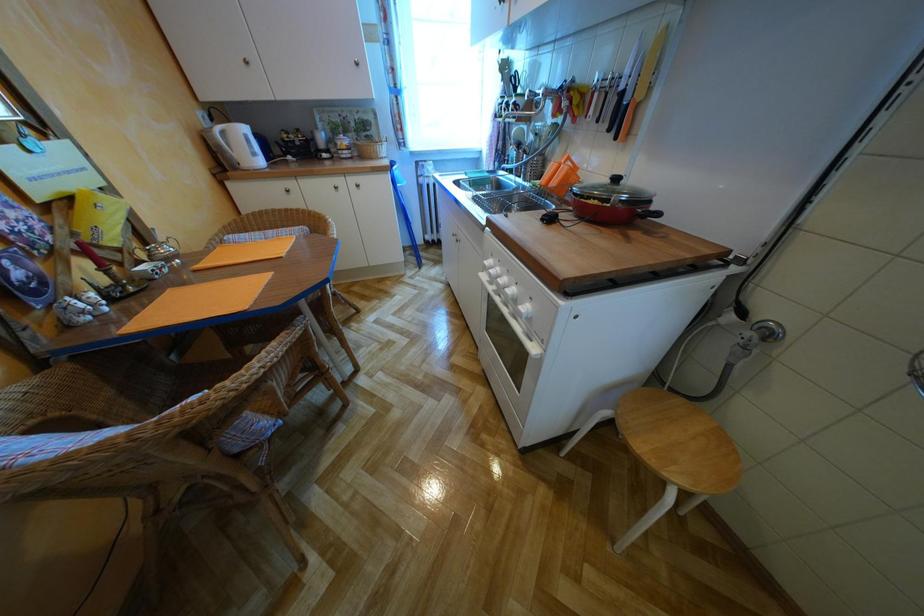
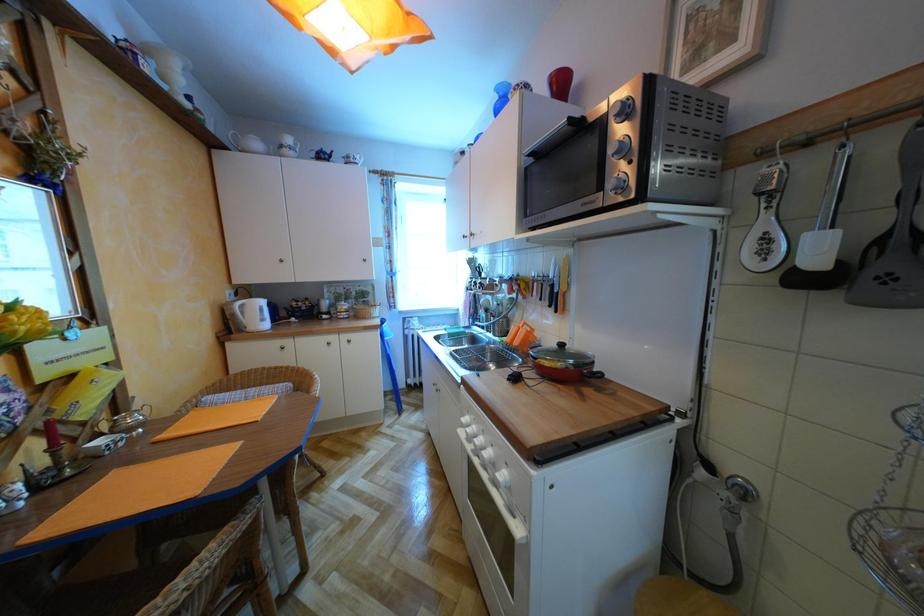
Question: The images are taken continuously from a first-person perspective. In which direction is your viewpoint rotating?

Choices:
 (A) Left
 (B) Right
 (C) Up
 (D) Down

Answer: (C)